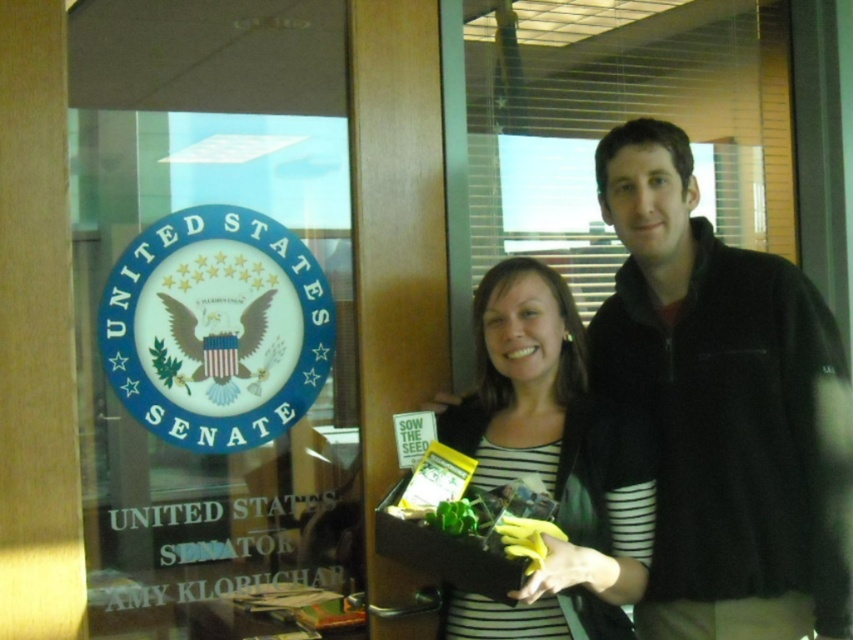
You are a security guard in the office. You notice the black fleece jacket at center and the transparent glass at upper left. Which object is closer to you, the observer?

The transparent glass at upper left is closer to you because the black fleece jacket at center is behind it.

You are a delivery person who needs to place a package between the transparent glass at upper left and the striped fabric at center. The package requires 20 inches of space. Can you fit it there?

The transparent glass at upper left is 21.01 inches away from striped fabric at center, so yes, the package can fit between them since the distance is more than enough.